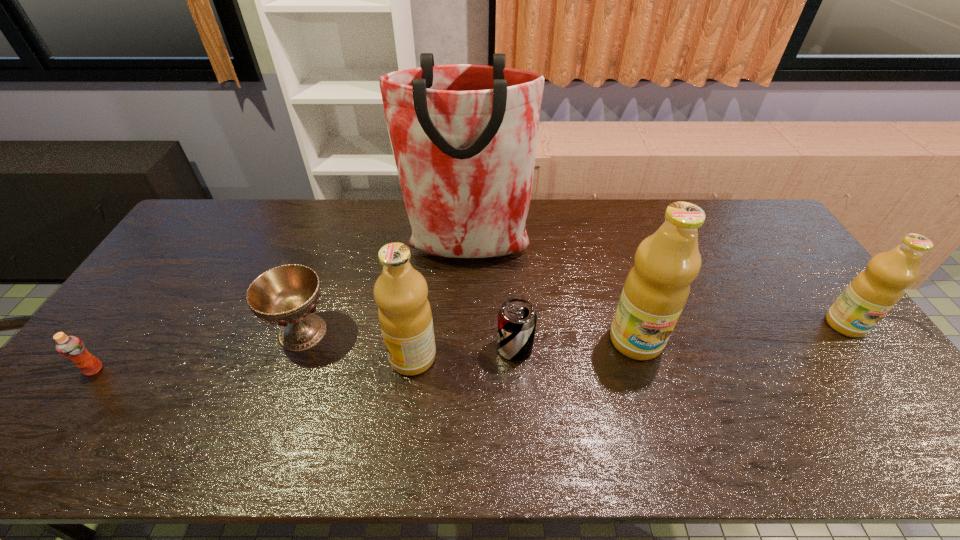
Locate an element on the screen. This screenshot has width=960, height=540. olive oil that stands as the second closest to the second tallest olive oil is located at coordinates (876, 290).

Identify the location of vacant region that satisfies the following two spatial constraints: 1. on the label of the shortest olive oil; 2. on the label of the second tallest olive oil. (870, 357).